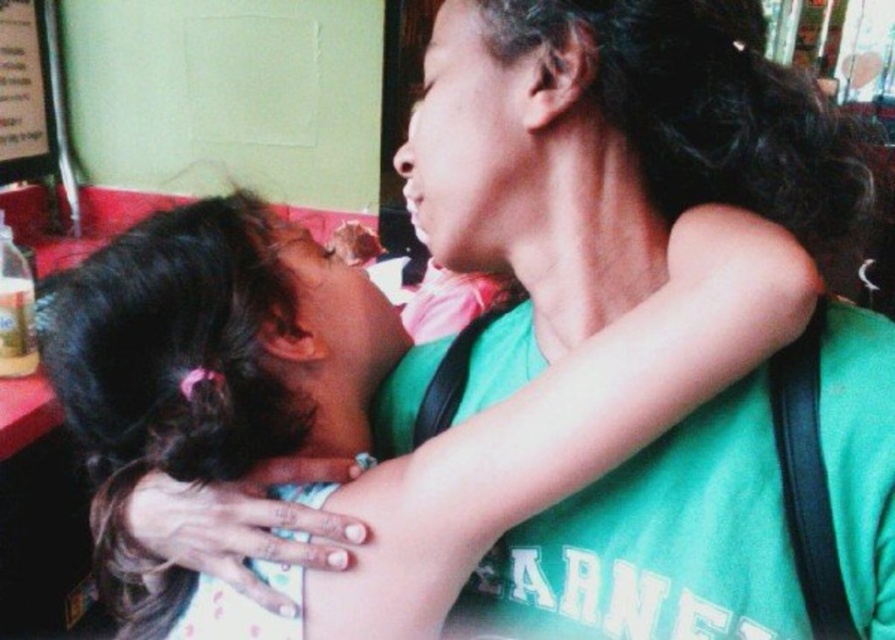
You are a photographer trying to capture the perfect shot of the scene. You want to focus on the dark brown hair at upper left located at point [211,348]. What is the exact coordinate of the dark brown hair at upper left?

The dark brown hair at upper left is located exactly at point [211,348].

What are the coordinates of the dark brown hair at upper left?

The dark brown hair at upper left is located at point (x=211, y=348).

You are taking a photo of the scene and want to focus on both point (516, 508) and point (14, 113). Which point should you adjust your focus to first to ensure it is in sharp focus?

Point (516, 508) is closer to the camera than point (14, 113), so you should focus on point (516, 508) first to ensure it is in sharp focus.